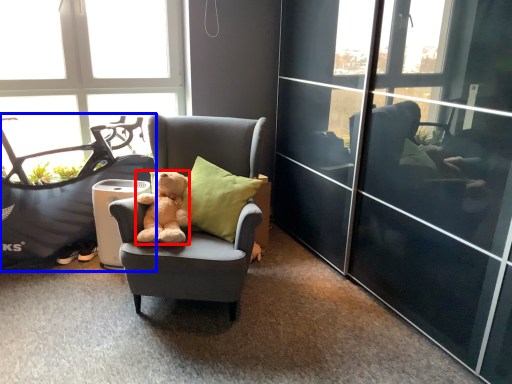
Question: Which of the following is the closest to the observer, teddy bear (highlighted by a red box) or mountain bike (highlighted by a blue box)?

Choices:
 (A) teddy bear
 (B) mountain bike

Answer: (A)